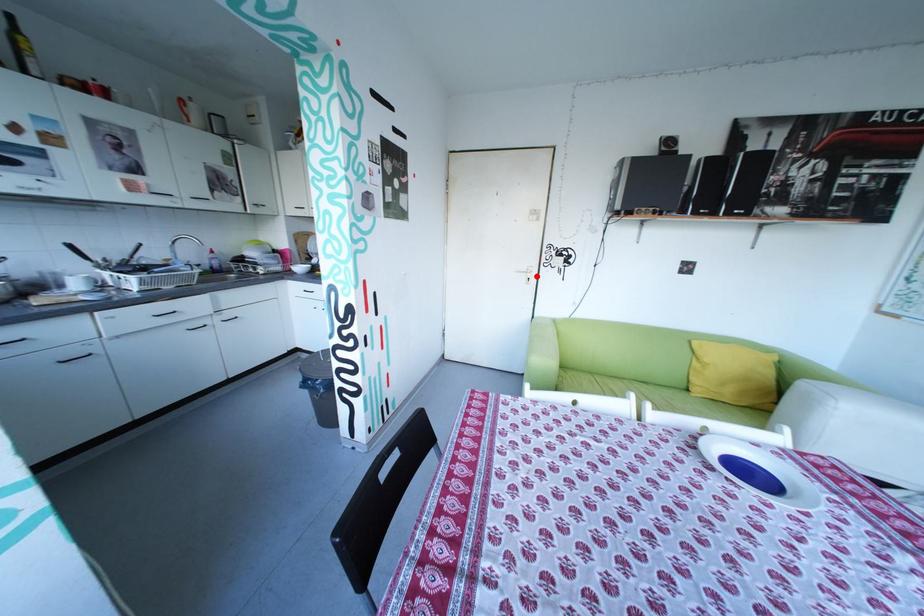
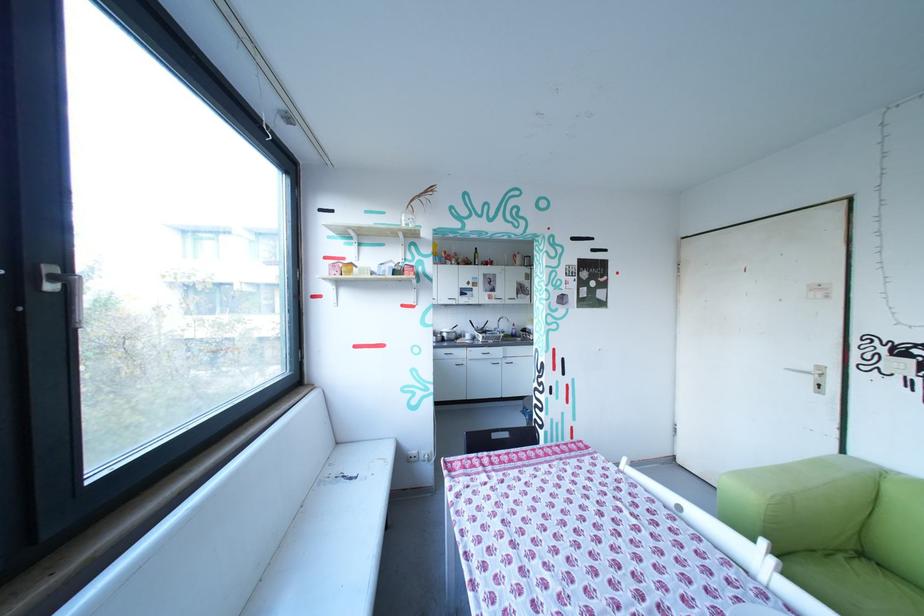
Locate, in the second image, the point that corresponds to the highlighted location in the first image.

(821, 379)